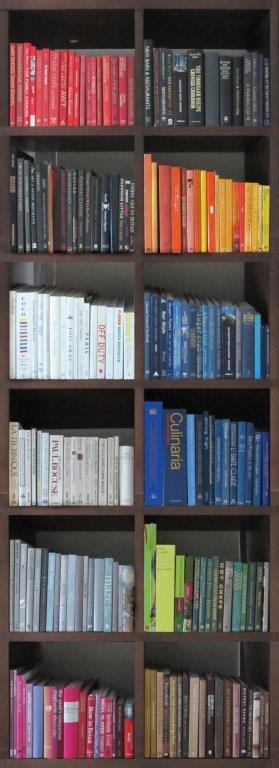
You are a GUI agent. You are given a task and a screenshot of the screen. Output one action in this format:
    pyautogui.click(x=<x>, y=<y>)
    Task: Click on the books
    The width and height of the screenshot is (279, 768).
    Given the screenshot: What is the action you would take?
    pyautogui.click(x=215, y=714)